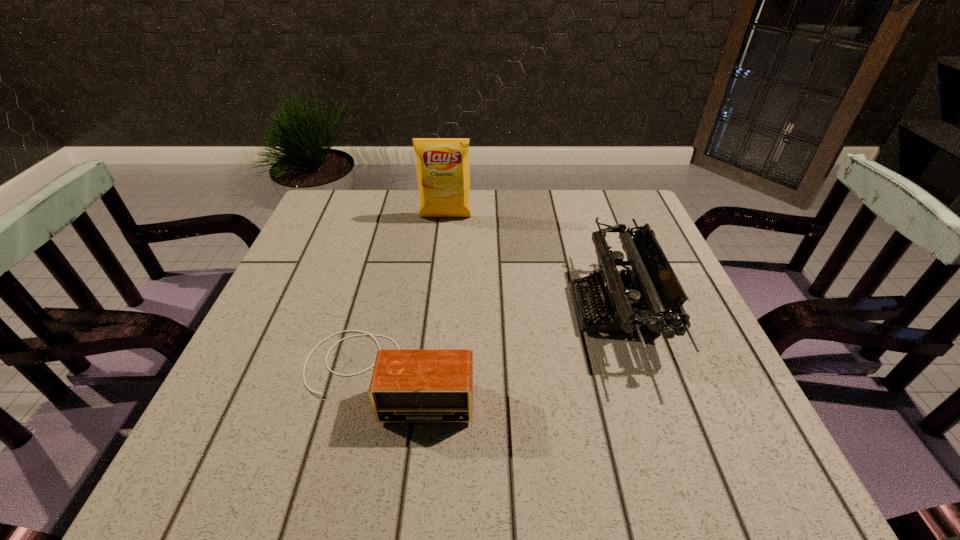
The height and width of the screenshot is (540, 960). Find the location of `empty space between the farthest object and the shortest object`. empty space between the farthest object and the shortest object is located at coordinates (417, 295).

This screenshot has width=960, height=540. I want to click on vacant space that's between the shortest object and the rightmost object, so click(x=501, y=341).

You are a GUI agent. You are given a task and a screenshot of the screen. Output one action in this format:
    pyautogui.click(x=<x>, y=<y>)
    Task: Click on the free space between the second tallest object and the radio receiver
    
    Given the screenshot: What is the action you would take?
    pyautogui.click(x=501, y=341)

Where is `vacant area that lies between the farthest object and the rightmost object`? vacant area that lies between the farthest object and the rightmost object is located at coordinates (530, 263).

Where is `unoccupied area between the shortest object and the second tallest object`? unoccupied area between the shortest object and the second tallest object is located at coordinates (501, 341).

Where is `unoccupied position between the typewriter and the radio receiver`? unoccupied position between the typewriter and the radio receiver is located at coordinates (501, 341).

Find the location of a particular element. Image resolution: width=960 pixels, height=540 pixels. vacant space in between the typewriter and the crisp (potato chip) is located at coordinates (530, 263).

Where is `the closest object to the second shortest object`? The height and width of the screenshot is (540, 960). the closest object to the second shortest object is located at coordinates (408, 385).

Locate an element on the screen. This screenshot has height=540, width=960. object that is the closest one to the crisp (potato chip) is located at coordinates (647, 298).

This screenshot has height=540, width=960. What are the coordinates of `free space that satisfies the following two spatial constraints: 1. on the typing side of the typewriter; 2. on the front-facing side of the radio receiver` in the screenshot? It's located at (636, 374).